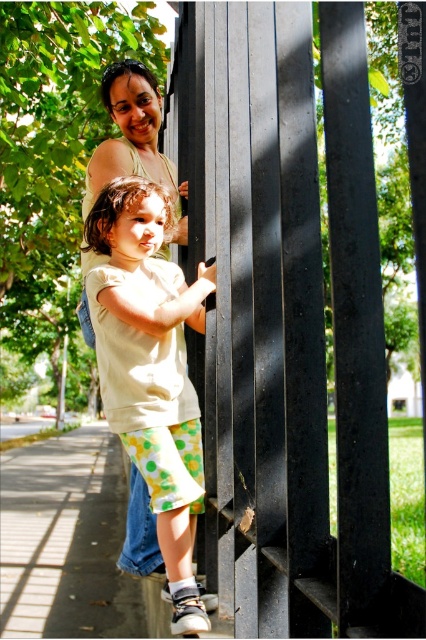
Question: Can you confirm if light beige cotton shirt at center is positioned to the right of gray asphalt pavement at lower left?

Choices:
 (A) yes
 (B) no

Answer: (A)

Question: Is gray asphalt pavement at lower left to the left of matte green tank top at upper center from the viewer's perspective?

Choices:
 (A) no
 (B) yes

Answer: (B)

Question: Which point is closer to the camera?

Choices:
 (A) matte green tank top at upper center
 (B) black matte fence at upper center

Answer: (B)

Question: Which point is closer to the camera?

Choices:
 (A) gray asphalt pavement at lower left
 (B) matte green tank top at upper center

Answer: (B)

Question: Which is farther from the black matte fence at upper center?

Choices:
 (A) light beige cotton shirt at center
 (B) matte green tank top at upper center
 (C) gray asphalt pavement at lower left

Answer: (C)

Question: Does gray asphalt pavement at lower left appear on the right side of matte green tank top at upper center?

Choices:
 (A) no
 (B) yes

Answer: (A)